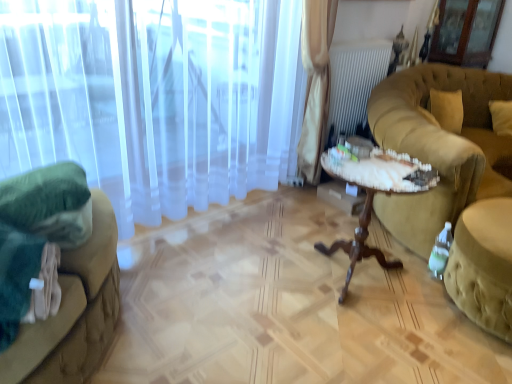
Locate an element on the screen. The image size is (512, 384). free point below woodenwoodentable at right (from a real-world perspective) is located at coordinates (360, 279).